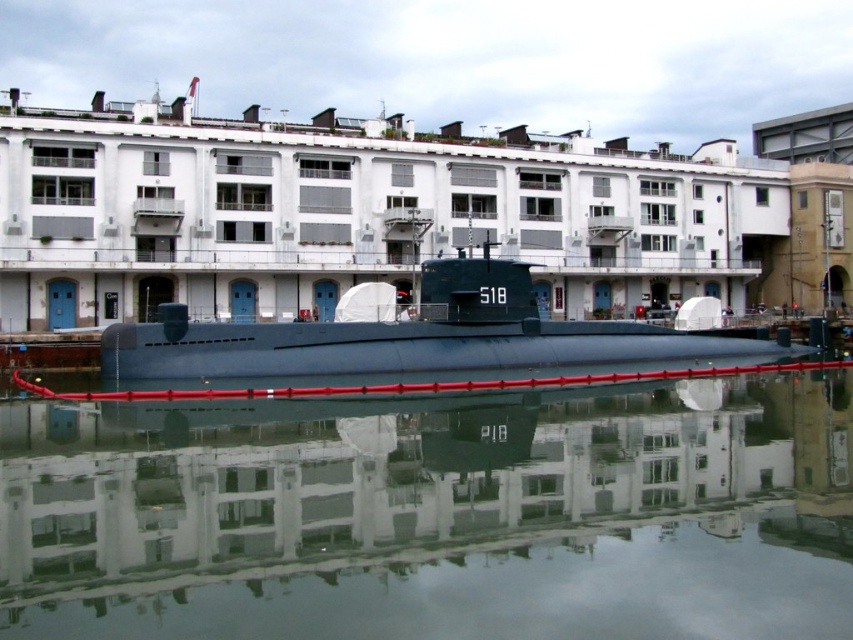
You are a photographer taking a picture of the submarine and the waterfront. You notice two points marked in the image. The first point is at coordinates point (840, 620) and the second point is at point (421, 275). Which point is closer to your camera lens?

Point (840, 620) is closer to the camera than point (421, 275).

You are a naval engineer inspecting the submarine. You notice the transparent glass water at center and the matte black submarine at center. From your vantage point, which object is located to the right?

The transparent glass water at center is positioned on the right side of the matte black submarine at center, so it is located to the right.